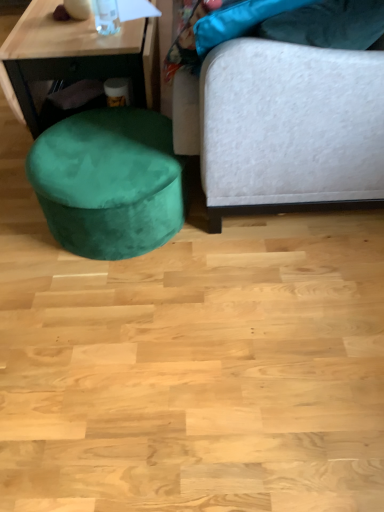
Question: Is transparent glass bottle at upper left closer to the viewer compared to velvet green ottoman at lower left?

Choices:
 (A) yes
 (B) no

Answer: (A)

Question: Is velvet green ottoman at lower left at the back of transparent glass bottle at upper left?

Choices:
 (A) no
 (B) yes

Answer: (A)

Question: Considering the relative positions of transparent glass bottle at upper left and velvet green ottoman at lower left in the image provided, is transparent glass bottle at upper left to the right of velvet green ottoman at lower left from the viewer's perspective?

Choices:
 (A) yes
 (B) no

Answer: (A)

Question: Can you confirm if transparent glass bottle at upper left is wider than velvet green ottoman at lower left?

Choices:
 (A) no
 (B) yes

Answer: (A)

Question: Is the surface of transparent glass bottle at upper left in direct contact with velvet green ottoman at lower left?

Choices:
 (A) yes
 (B) no

Answer: (B)

Question: Which is correct: velvet green ottoman at lower left is inside velvet green ottoman at lower left, or outside of it?

Choices:
 (A) outside
 (B) inside

Answer: (A)

Question: From the image's perspective, is velvet green ottoman at lower left positioned above or below velvet green ottoman at lower left?

Choices:
 (A) below
 (B) above

Answer: (A)

Question: Is velvet green ottoman at lower left taller or shorter than velvet green ottoman at lower left?

Choices:
 (A) tall
 (B) short

Answer: (B)

Question: Based on their sizes in the image, would you say velvet green ottoman at lower left is bigger or smaller than velvet green ottoman at lower left?

Choices:
 (A) big
 (B) small

Answer: (B)

Question: Relative to velvet white studio couch at right, is velvet green ottoman at lower left in front or behind?

Choices:
 (A) behind
 (B) front

Answer: (A)

Question: From the image's perspective, is velvet green ottoman at lower left above or below velvet white studio couch at right?

Choices:
 (A) below
 (B) above

Answer: (A)

Question: From their relative heights in the image, would you say velvet green ottoman at lower left is taller or shorter than velvet white studio couch at right?

Choices:
 (A) short
 (B) tall

Answer: (A)

Question: Considering the relative positions of velvet green ottoman at lower left and velvet white studio couch at right in the image provided, is velvet green ottoman at lower left to the left or to the right of velvet white studio couch at right?

Choices:
 (A) left
 (B) right

Answer: (A)

Question: Is transparent glass bottle at upper left situated inside velvet green ottoman at lower left or outside?

Choices:
 (A) outside
 (B) inside

Answer: (A)

Question: From the image's perspective, relative to velvet green ottoman at lower left, is transparent glass bottle at upper left above or below?

Choices:
 (A) above
 (B) below

Answer: (A)